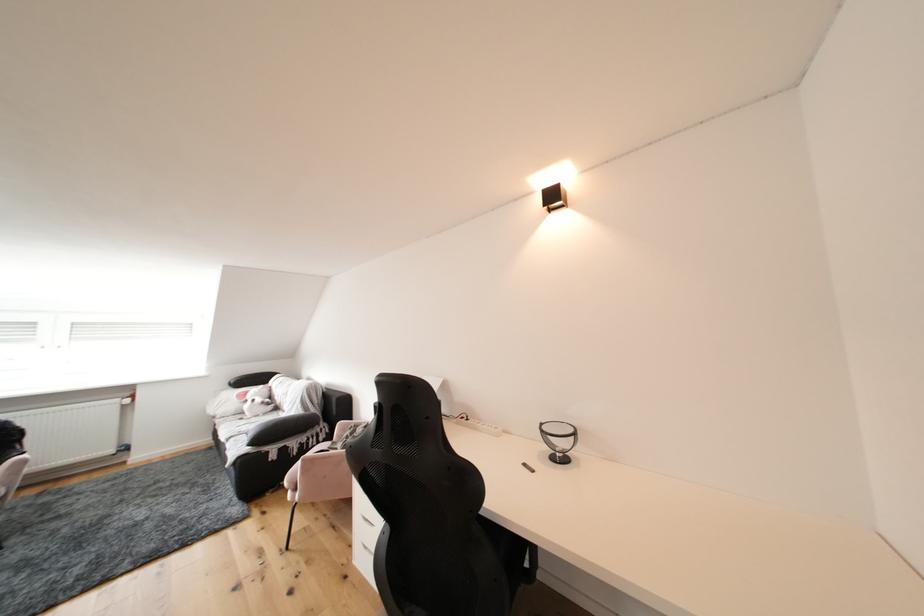
Which object does [258,400] point to?

It corresponds to the white stuffed toy in the image.